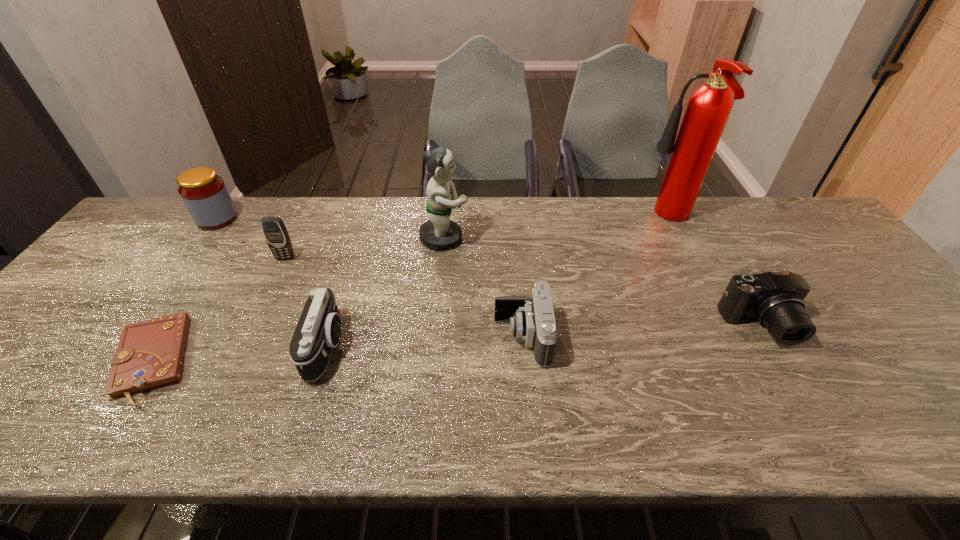
The width and height of the screenshot is (960, 540). Identify the location of free space located 0.130m at the nozzle of the fire extinguisher. (603, 218).

Image resolution: width=960 pixels, height=540 pixels. In order to click on free point located at the nozzle of the fire extinguisher in this screenshot , I will do 542,218.

Locate an element on the screen. This screenshot has height=540, width=960. free spot located 0.390m at the nozzle of the fire extinguisher is located at coordinates (520, 218).

I want to click on vacant space positioned 0.320m on the front-facing side of the fourth object from right to left, so click(x=576, y=238).

The image size is (960, 540). In order to click on free point located 0.050m on the back of the jar in this screenshot , I will do `click(231, 199)`.

I want to click on free space located on the front face of the third object from left to right, so click(x=268, y=294).

Identify the location of vacant space located on the front lens of the leftmost camera. (466, 346).

Identify the location of free spot located 0.140m on the lens of the rightmost camera. (805, 403).

Identify the location of blank area located at the front of the third object from right to left with an open lens cover. The width and height of the screenshot is (960, 540). (377, 338).

At what (x,y) coordinates should I click in order to perform the action: click on vacant space located at the front of the third object from right to left with an open lens cover. Please return your answer as a coordinate pair (x, y). The image size is (960, 540). Looking at the image, I should click on (369, 338).